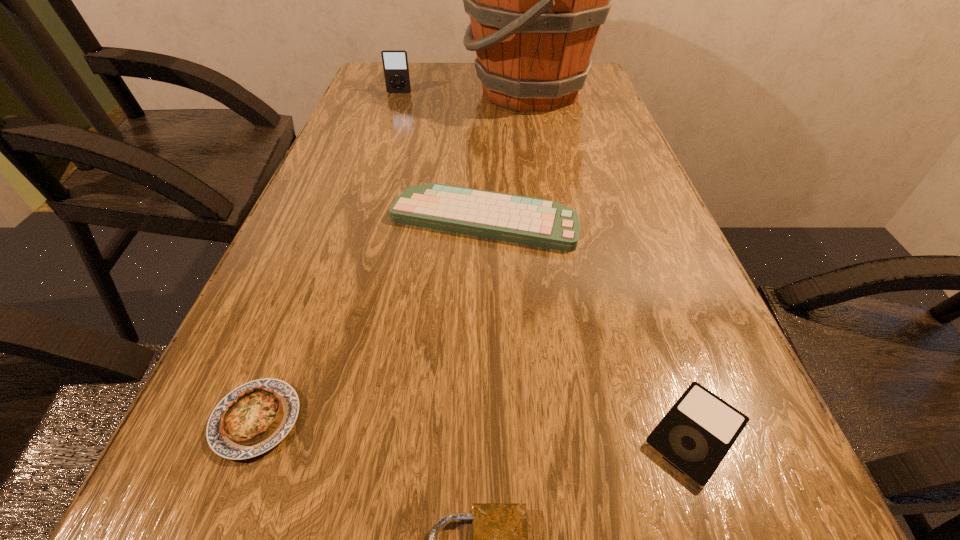
The width and height of the screenshot is (960, 540). I want to click on free space between the bucket and the shortest object, so click(613, 262).

What are the coordinates of `object that is the third closest to the nearest object` in the screenshot? It's located at (544, 223).

Find the location of a particular element. This screenshot has height=540, width=960. the fifth closest object to the nearest object is located at coordinates (395, 61).

What are the coordinates of `vacant region that satisfies the following two spatial constraints: 1. on the handle side of the bucket; 2. on the front side of the third farthest object` in the screenshot? It's located at 556,220.

You are a GUI agent. You are given a task and a screenshot of the screen. Output one action in this format:
    pyautogui.click(x=<x>, y=<y>)
    Task: Click on the free space that satisfies the following two spatial constraints: 1. on the front side of the nearer iPod; 2. on the left side of the third farthest object
    The width and height of the screenshot is (960, 540).
    Given the screenshot: What is the action you would take?
    pyautogui.click(x=484, y=433)

This screenshot has width=960, height=540. Find the location of `vacant space that satisfies the following two spatial constraints: 1. on the front-facing side of the third farthest object; 2. on the right side of the taller iPod`. vacant space that satisfies the following two spatial constraints: 1. on the front-facing side of the third farthest object; 2. on the right side of the taller iPod is located at coordinates (359, 220).

At what (x,y) coordinates should I click in order to perform the action: click on free region that satisfies the following two spatial constraints: 1. on the handle side of the tallest object; 2. on the front side of the third tallest object. Please return your answer as a coordinate pair (x, y). This screenshot has width=960, height=540. Looking at the image, I should click on (556, 220).

This screenshot has width=960, height=540. What are the coordinates of `vacant position in the image that satisfies the following two spatial constraints: 1. on the handle side of the tallest object; 2. on the front-facing side of the second tallest object` in the screenshot? It's located at (531, 92).